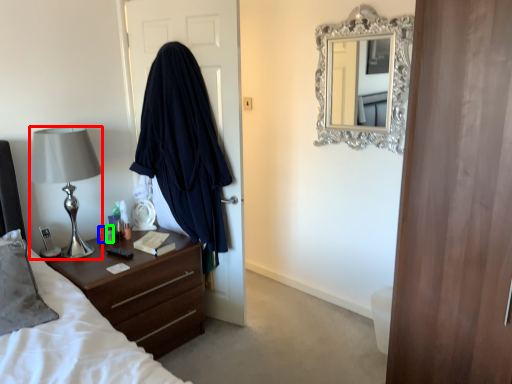
Question: Which object is positioned closest to lamp (highlighted by a red box)? Select from bottle (highlighted by a blue box) and bottle (highlighted by a green box).

Choices:
 (A) bottle
 (B) bottle

Answer: (B)